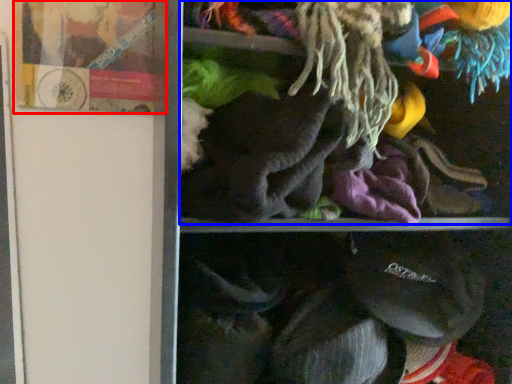
Question: Which object appears closest to the camera in this image, book (highlighted by a red box) or laundry (highlighted by a blue box)?

Choices:
 (A) book
 (B) laundry

Answer: (B)